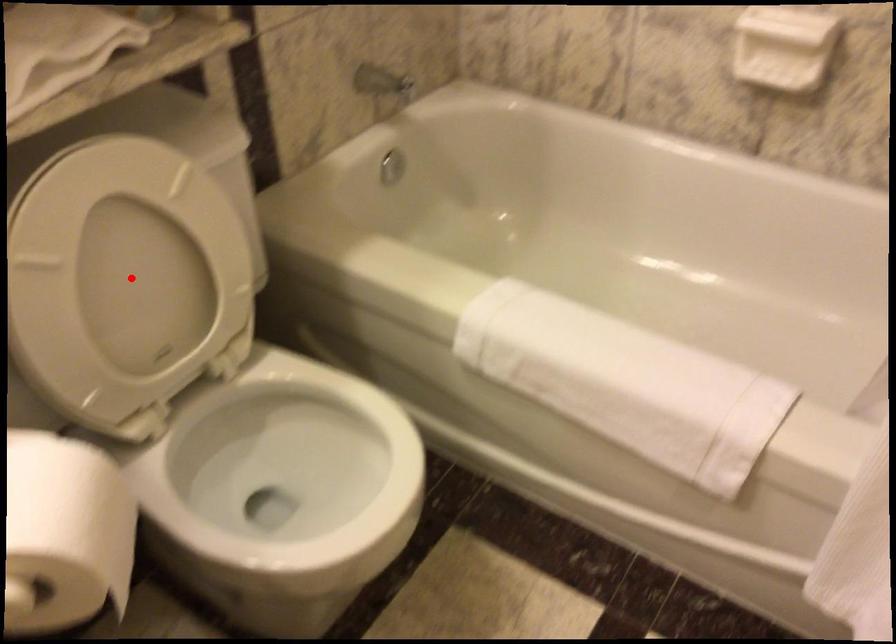
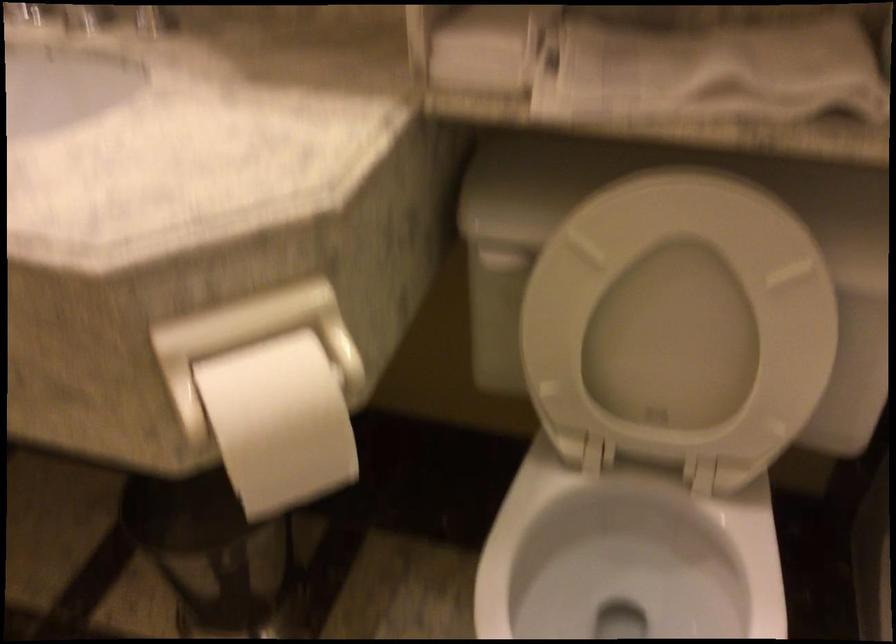
Question: I am providing you with two images of the same scene from different viewpoints. In image1, a red point is highlighted. Considering the same 3D point in image2, which of the following is correct?

Choices:
 (A) It is closer
 (B) It is farther

Answer: (A)